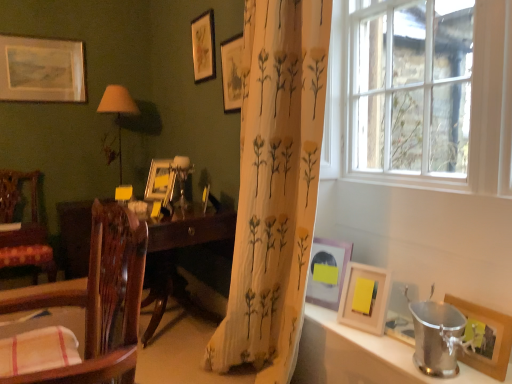
Question: In the image, is pink matte picture frame at lower right, the 3th picture frame in the right-to-left sequence, positioned in front of or behind matte brown lampshade at left?

Choices:
 (A) front
 (B) behind

Answer: (A)

Question: Is point (338, 253) closer or farther from the camera than point (118, 165)?

Choices:
 (A) farther
 (B) closer

Answer: (B)

Question: Based on their relative distances, which object is farther from the wooden desk at center?

Choices:
 (A) wooden picture frame at lower right, positioned as the second picture frame in front-to-back order
 (B) matte wooden picture frame at upper center, the fourth picture frame positioned from the back
 (C) wooden picture frame at right, the first picture frame when ordered from front to back
 (D) matte brown lampshade at left
 (E) pink matte picture frame at lower right, the 3th picture frame in the right-to-left sequence

Answer: (C)

Question: Which object is positioned closest to the wooden chair at left, arranged as the first chair when viewed from the right?

Choices:
 (A) pink matte picture frame at lower right, which ranks as the 3th picture frame in front-to-back order
 (B) wooden desk at center
 (C) matte gold picture frame at upper center, which is the 5th picture frame from right to left
 (D) wooden chair with floral upholstery at left, which is counted as the 1th chair, starting from the left
 (E) matte gold picture frame at center, marked as the 2th picture frame in a left-to-right arrangement

Answer: (A)